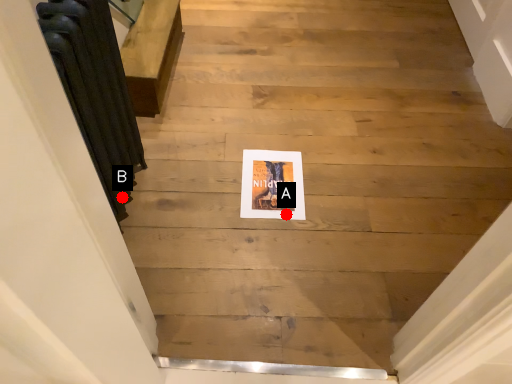
Question: Two points are circled on the image, labeled by A and B beside each circle. Which of the following is the farthest from the observer?

Choices:
 (A) A is further
 (B) B is further

Answer: (A)